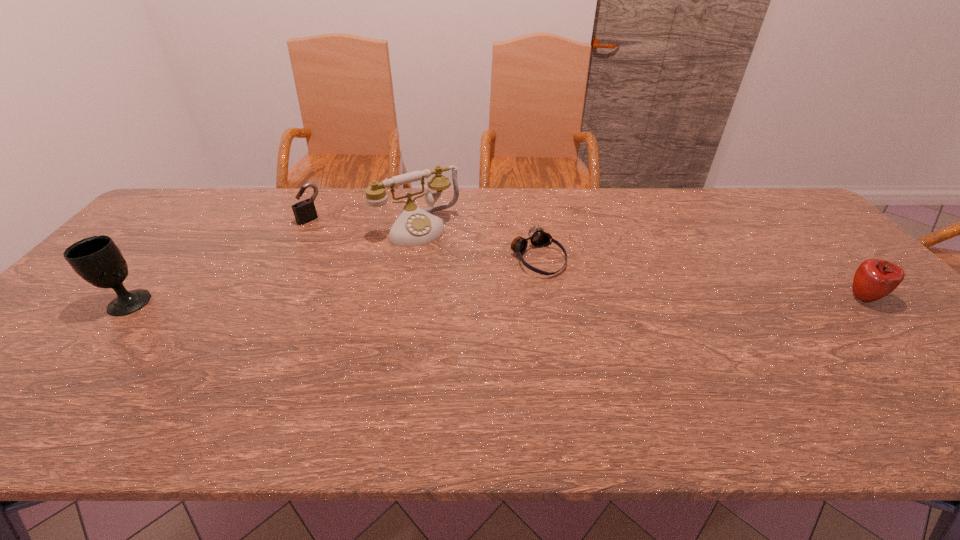
Locate an element on the screen. The height and width of the screenshot is (540, 960). free space on the desktop that is between the chalice and the apple and is positioned on the dial of the telephone is located at coordinates (473, 300).

Where is `free space on the desktop that is between the leftmost object and the rightmost object and is positioned through the lenses of the fourth object from left to right`? free space on the desktop that is between the leftmost object and the rightmost object and is positioned through the lenses of the fourth object from left to right is located at coordinates (589, 300).

In order to click on vacant space on the desktop that is between the leftmost object and the rightmost object and is positioned with the keyhole on the front of the padlock in this screenshot , I will do `click(419, 301)`.